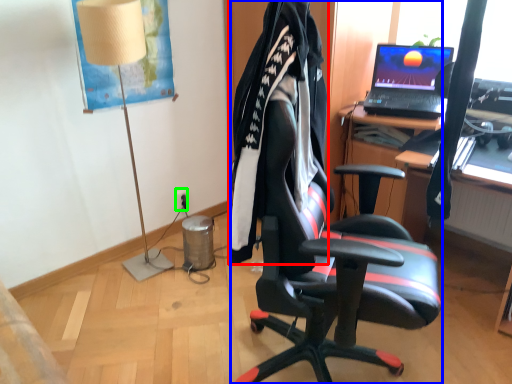
Question: Which object is positioned closest to clothing (highlighted by a red box)? Select from chair (highlighted by a blue box) and power outlet (highlighted by a green box).

Choices:
 (A) chair
 (B) power outlet

Answer: (A)